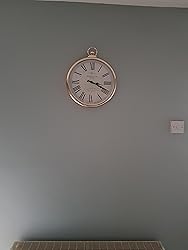
Where is `brass frame`? This screenshot has width=188, height=250. brass frame is located at coordinates (106, 100).